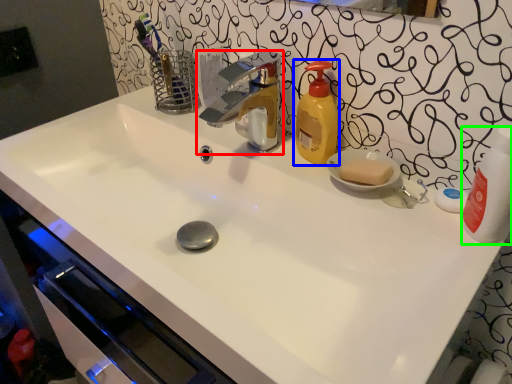
Question: Which is nearer to the tap (highlighted by a red box)? soap dispenser (highlighted by a blue box) or cleaning product (highlighted by a green box).

Choices:
 (A) soap dispenser
 (B) cleaning product

Answer: (A)